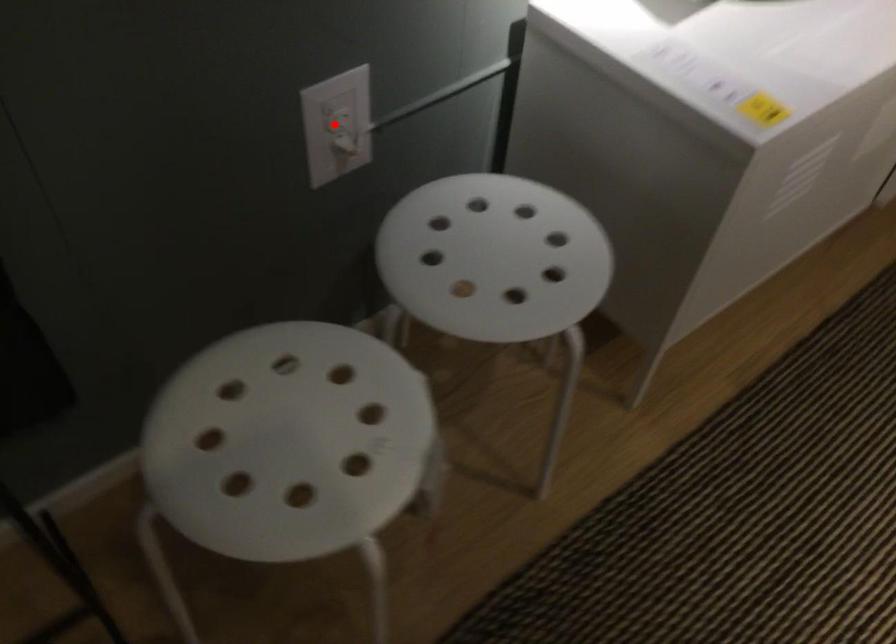
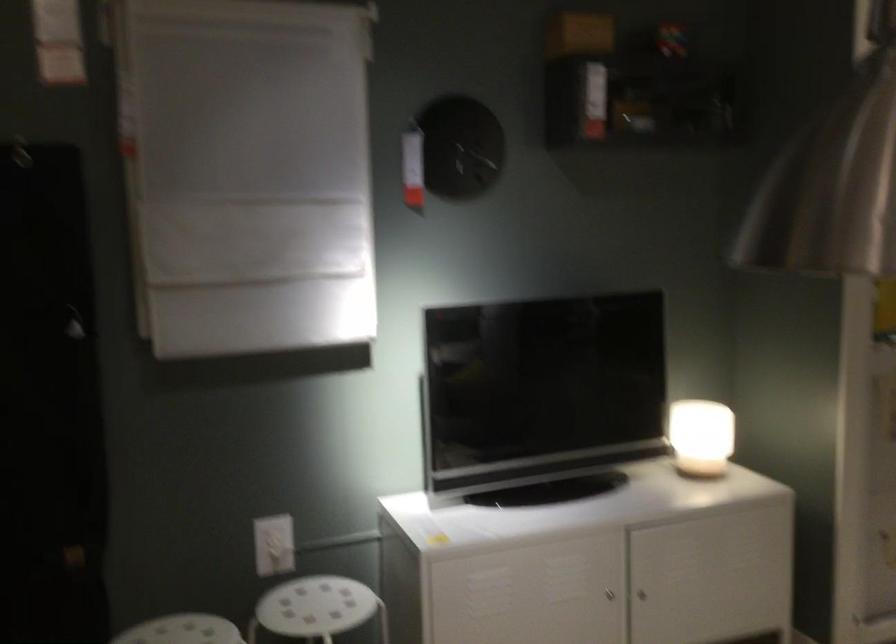
Find the pixel in the second image that matches the highlighted location in the first image.

(273, 545)